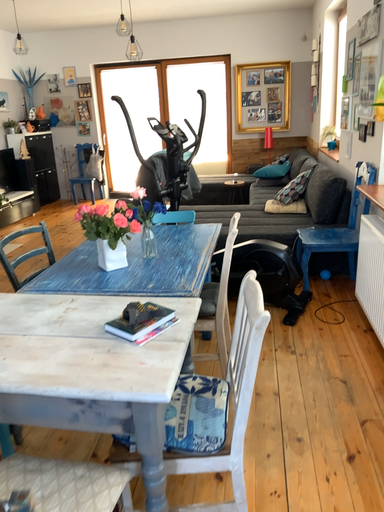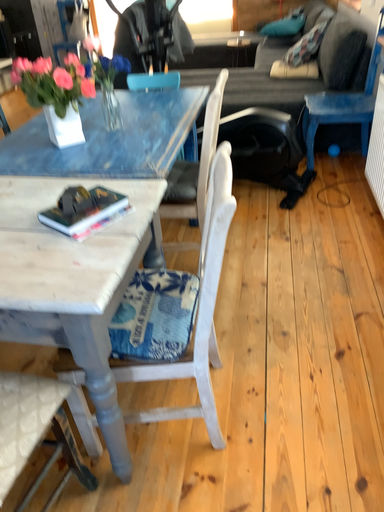
Question: Which way did the camera rotate in the video?

Choices:
 (A) rotated downward
 (B) rotated upward

Answer: (A)